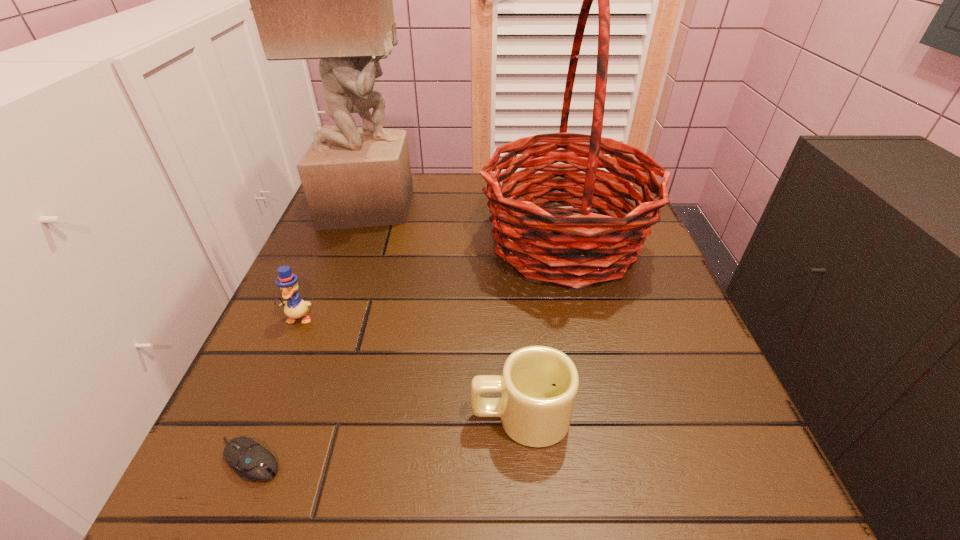
Identify the location of vacant point located with the handle on the side of the mug. (308, 416).

This screenshot has width=960, height=540. Find the location of `vacant space situated 0.200m on the right of the computer mouse`. vacant space situated 0.200m on the right of the computer mouse is located at coordinates (430, 460).

Locate an element on the screen. sculpture situated at the far edge is located at coordinates (331, 0).

Find the location of a particular element. The width and height of the screenshot is (960, 540). basket positioned at the far edge is located at coordinates (572, 254).

The width and height of the screenshot is (960, 540). I want to click on object located at the near edge, so click(251, 461).

Where is `sculpture at the left edge`? sculpture at the left edge is located at coordinates (331, 0).

The height and width of the screenshot is (540, 960). I want to click on duckling situated at the left edge, so click(294, 307).

Find the location of a particular element. The width and height of the screenshot is (960, 540). computer mouse that is positioned at the left edge is located at coordinates (251, 461).

Identify the location of object present at the right edge. The width and height of the screenshot is (960, 540). (572, 254).

The width and height of the screenshot is (960, 540). I want to click on object present at the far left corner, so click(x=331, y=0).